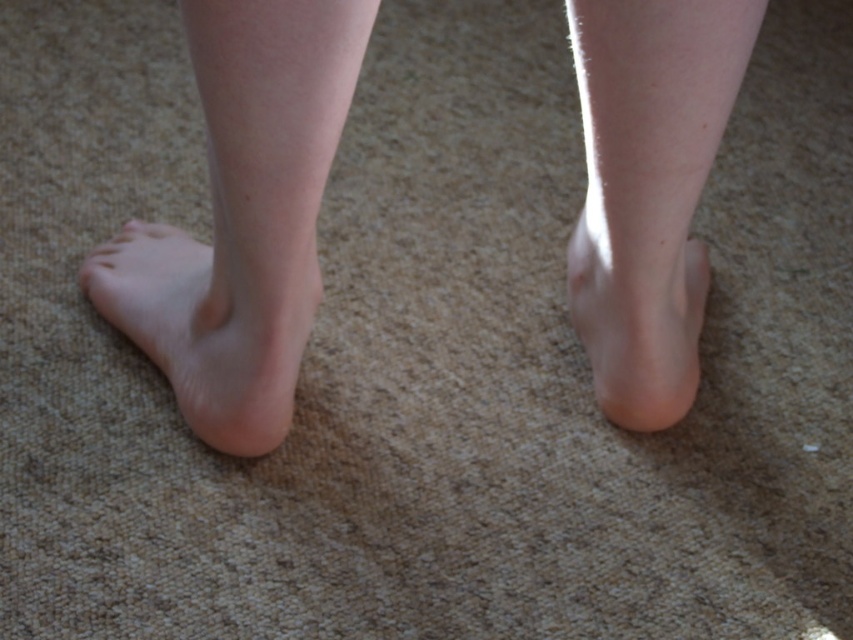
Question: Estimate the real-world distances between objects in this image. Which object is closer to the skinny legs at center?

Choices:
 (A) smooth skin leg at left
 (B) smooth skin leg at center

Answer: (A)

Question: Does pale skin/soft foot at lower left appear on the left side of smooth skin foot at center?

Choices:
 (A) no
 (B) yes

Answer: (B)

Question: Is skinny legs at center to the right of pale skin/soft foot at lower left from the viewer's perspective?

Choices:
 (A) no
 (B) yes

Answer: (B)

Question: Which point appears closest to the camera in this image?

Choices:
 (A) (608, 252)
 (B) (285, 419)

Answer: (A)

Question: Is skinny legs at center smaller than smooth skin leg at center?

Choices:
 (A) no
 (B) yes

Answer: (A)

Question: Which object is positioned farthest from the pale skin/soft foot at lower left?

Choices:
 (A) smooth skin foot at center
 (B) smooth skin leg at center
 (C) smooth skin leg at left

Answer: (B)